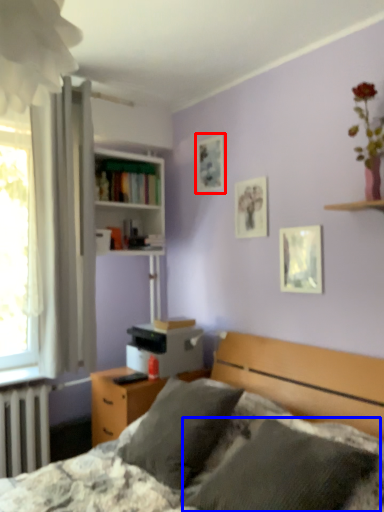
Question: Which point is further to the camera, picture frame (highlighted by a red box) or pillow (highlighted by a blue box)?

Choices:
 (A) picture frame
 (B) pillow

Answer: (A)